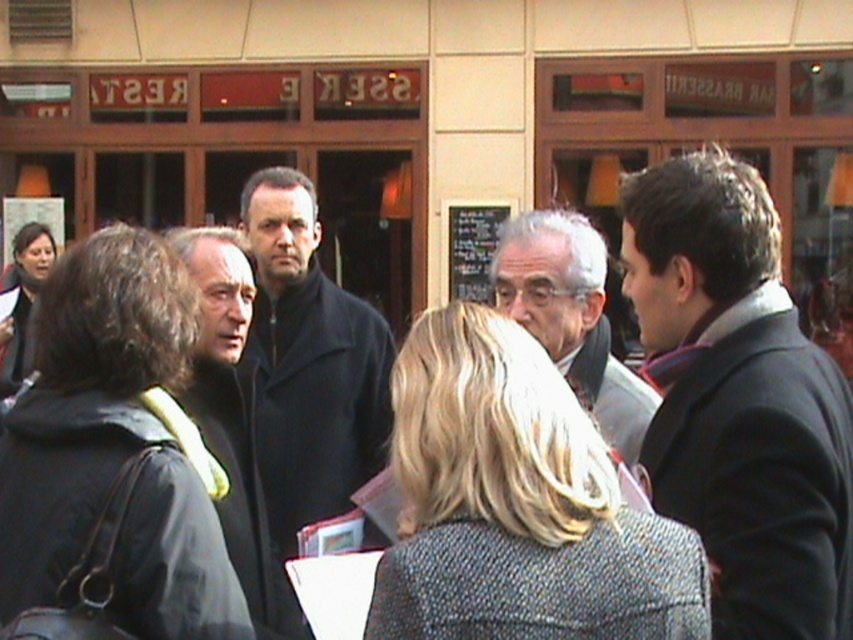
Question: Which point appears farthest from the camera in this image?

Choices:
 (A) (282, 518)
 (B) (621, 419)

Answer: (A)

Question: Which object is positioned closest to the dark brown leather jacket at left?

Choices:
 (A) dark gray wool coat at right
 (B) dark matte coat at center

Answer: (B)

Question: Can you confirm if dark gray wool coat at right is smaller than gray hair at center?

Choices:
 (A) yes
 (B) no

Answer: (B)

Question: Which object is closer to the camera taking this photo?

Choices:
 (A) dark brown leather jacket at left
 (B) dark gray wool coat at right
 (C) gray hair at center

Answer: (B)

Question: Is dark gray wool coat at right thinner than gray hair at center?

Choices:
 (A) yes
 (B) no

Answer: (B)

Question: Is dark gray wool coat at right thinner than dark brown leather jacket at left?

Choices:
 (A) yes
 (B) no

Answer: (B)